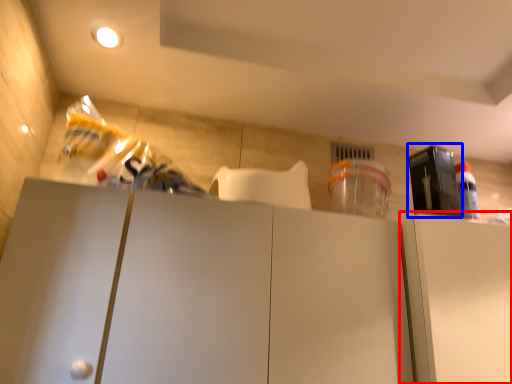
Question: Among these objects, which one is nearest to the camera, cabinetry (highlighted by a red box) or appliance (highlighted by a blue box)?

Choices:
 (A) cabinetry
 (B) appliance

Answer: (A)